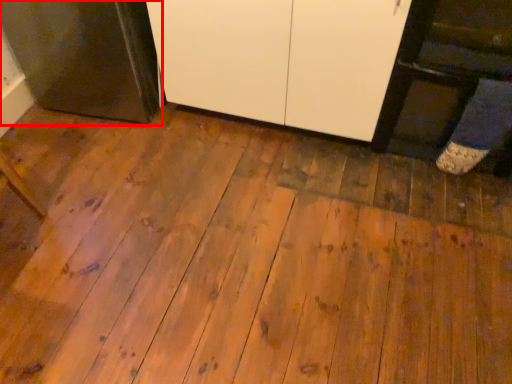
Question: From the image's perspective, where is appliance (annotated by the red box) located relative to cabinetry?

Choices:
 (A) above
 (B) below

Answer: (A)